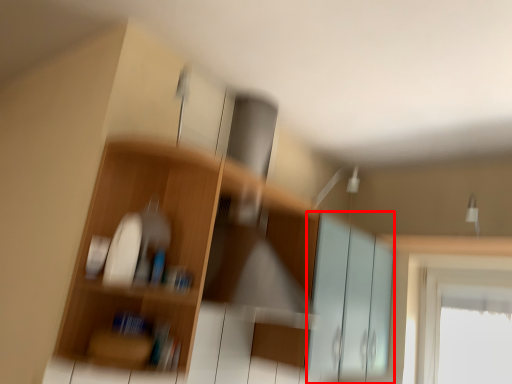
Question: From the image's perspective, where is screen door (annotated by the red box) located relative to shelf?

Choices:
 (A) above
 (B) below

Answer: (B)